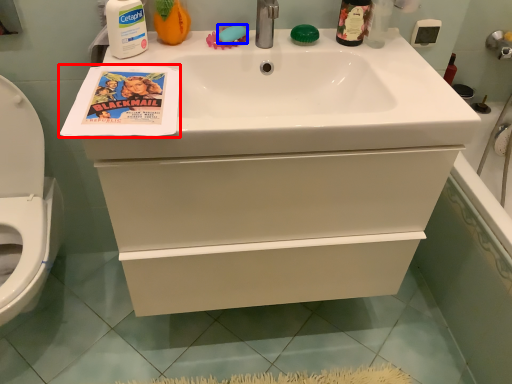
Question: Which object is further to the camera taking this photo, comic book (highlighted by a red box) or soap (highlighted by a blue box)?

Choices:
 (A) comic book
 (B) soap

Answer: (B)